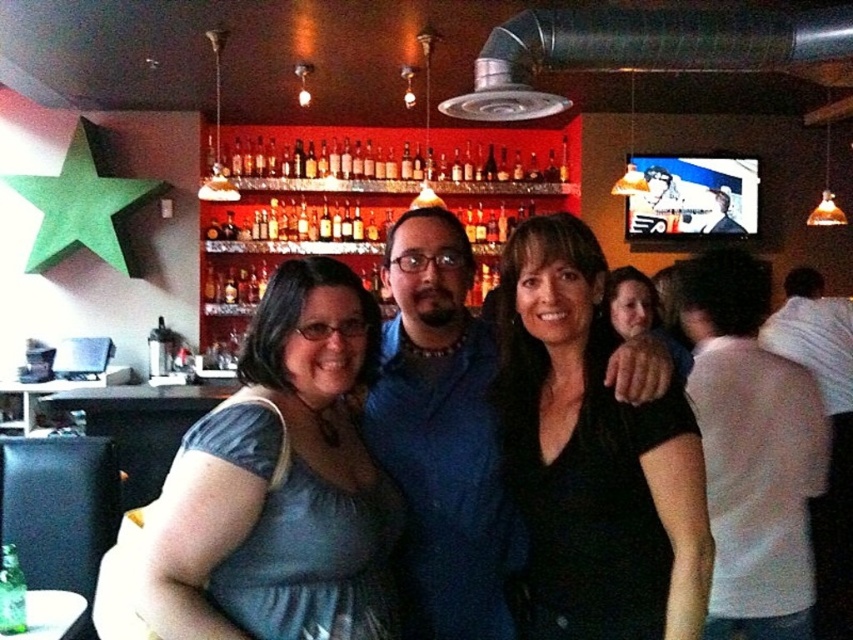
Question: Does black matte shirt at center have a lesser width compared to translucent glass bottles at center?

Choices:
 (A) yes
 (B) no

Answer: (A)

Question: Which object appears closest to the camera in this image?

Choices:
 (A) black matte shirt at center
 (B) white cotton shirt at right
 (C) translucent glass bottles at center
 (D) shiny blue dress at center

Answer: (A)

Question: Is shiny blue dress at center further to camera compared to white cotton shirt at right?

Choices:
 (A) yes
 (B) no

Answer: (B)

Question: Which of the following is the closest to the observer?

Choices:
 (A) translucent glass bottles at center
 (B) shiny blue dress at center
 (C) black matte shirt at center

Answer: (C)

Question: Which object is farther from the camera taking this photo?

Choices:
 (A) white cotton shirt at right
 (B) black matte shirt at center
 (C) translucent glass bottles at center
 (D) shiny blue dress at center

Answer: (C)

Question: Observing the image, what is the correct spatial positioning of shiny blue dress at center in reference to translucent glass bottles at center?

Choices:
 (A) right
 (B) left

Answer: (A)